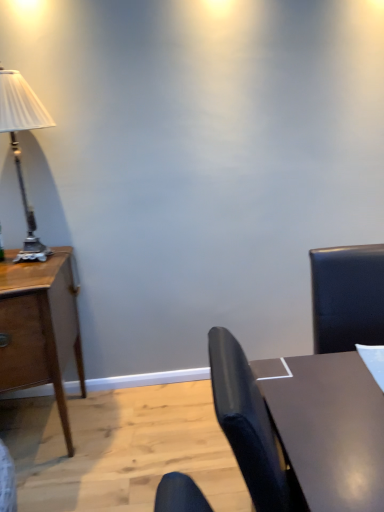
Question: Is wooden desk at left in front of or behind silver metallic lamp at left in the image?

Choices:
 (A) behind
 (B) front

Answer: (B)

Question: From the image's perspective, is wooden desk at left positioned above or below silver metallic lamp at left?

Choices:
 (A) below
 (B) above

Answer: (A)

Question: Which is farther from the wooden desk at left?

Choices:
 (A) shiny brown table at lower right
 (B) silver metallic lamp at left

Answer: (A)

Question: Estimate the real-world distances between objects in this image. Which object is closer to the silver metallic lamp at left?

Choices:
 (A) shiny brown table at lower right
 (B) wooden desk at left

Answer: (B)